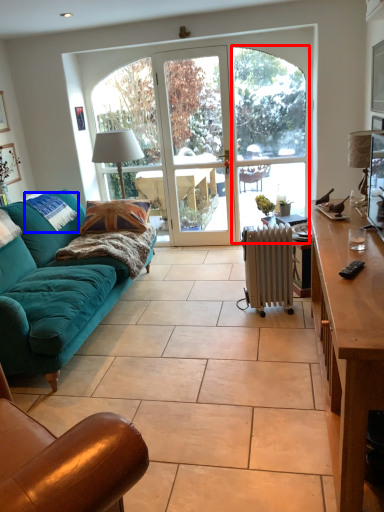
Question: Which of the following is the closest to the observer, glass door (highlighted by a red box) or pillow (highlighted by a blue box)?

Choices:
 (A) glass door
 (B) pillow

Answer: (B)